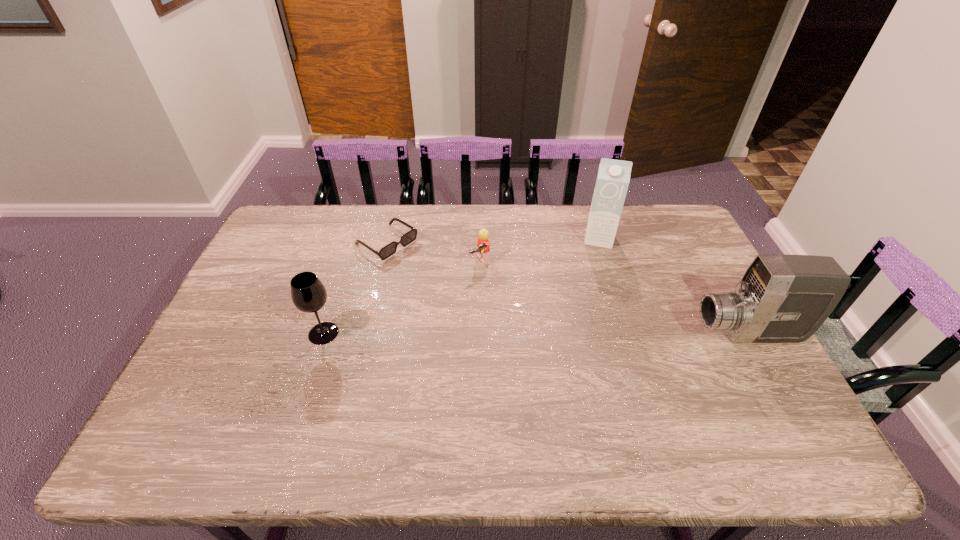
Where is `vacant space located 0.230m at the front of the camcorder, highlighting the lens`? The image size is (960, 540). vacant space located 0.230m at the front of the camcorder, highlighting the lens is located at coordinates (612, 334).

Locate an element on the screen. This screenshot has width=960, height=540. vacant space located at the front of the camcorder, highlighting the lens is located at coordinates (630, 334).

The height and width of the screenshot is (540, 960). I want to click on free space located on the front-facing side of the sunglasses, so click(424, 267).

I want to click on free spot located 0.200m on the front-facing side of the sunglasses, so click(x=451, y=284).

The image size is (960, 540). In order to click on vacant space located on the front-facing side of the sunglasses in this screenshot , I will do `click(438, 275)`.

Where is `vacant space situated in front of the Lego with the accessory visible`? vacant space situated in front of the Lego with the accessory visible is located at coordinates (546, 349).

The image size is (960, 540). I want to click on vacant space located 0.090m in front of the Lego with the accessory visible, so click(498, 289).

The width and height of the screenshot is (960, 540). What are the coordinates of `free space located in front of the Lego with the accessory visible` in the screenshot? It's located at (495, 285).

This screenshot has height=540, width=960. I want to click on free space located on the front label of the carton, so click(x=588, y=335).

Where is `vacant space located 0.080m on the front label of the carton`? This screenshot has width=960, height=540. vacant space located 0.080m on the front label of the carton is located at coordinates tap(596, 264).